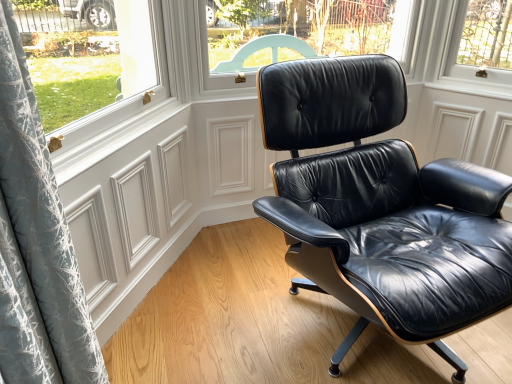
Question: Is point (164, 269) closer or farther from the camera than point (321, 243)?

Choices:
 (A) farther
 (B) closer

Answer: (A)

Question: Is white matte screen door at lower left inside or outside of black leather chair at center?

Choices:
 (A) inside
 (B) outside

Answer: (B)

Question: Considering the relative positions of white matte screen door at lower left and black leather chair at center in the image provided, is white matte screen door at lower left to the left or to the right of black leather chair at center?

Choices:
 (A) left
 (B) right

Answer: (A)

Question: Would you say black leather chair at center is to the left or to the right of white matte screen door at lower left in the picture?

Choices:
 (A) left
 (B) right

Answer: (B)

Question: Considering their positions, is black leather chair at center located in front of or behind white matte screen door at lower left?

Choices:
 (A) behind
 (B) front

Answer: (B)

Question: Looking at their shapes, would you say black leather chair at center is wider or thinner than white matte screen door at lower left?

Choices:
 (A) thin
 (B) wide

Answer: (B)

Question: From the image's perspective, is black leather chair at center positioned above or below white matte screen door at lower left?

Choices:
 (A) above
 (B) below

Answer: (A)